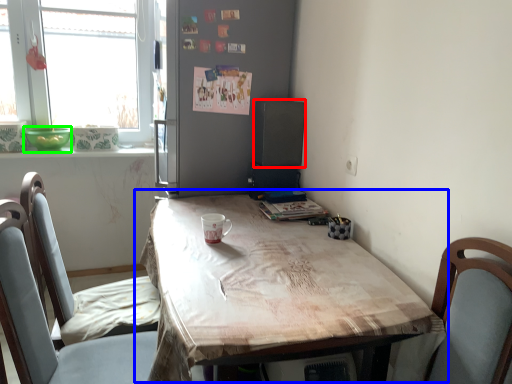
Question: Which object is the farthest from loudspeaker (highlighted by a red box)? Choose among these: table (highlighted by a blue box) or glass bowl (highlighted by a green box).

Choices:
 (A) table
 (B) glass bowl

Answer: (B)